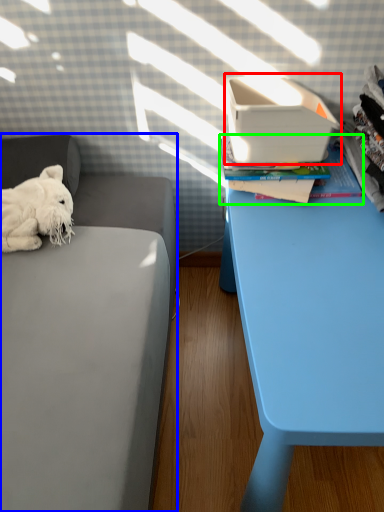
Question: Which object is the closest to the shoe box (highlighted by a red box)? Choose among these: furniture (highlighted by a blue box) or paperback book (highlighted by a green box).

Choices:
 (A) furniture
 (B) paperback book

Answer: (B)